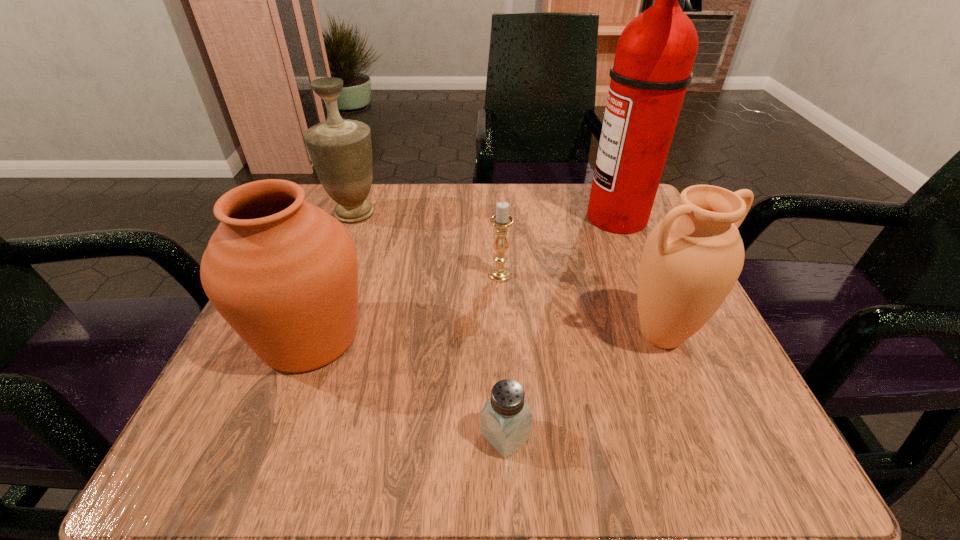
Where is `object present at the far right corner`? object present at the far right corner is located at coordinates (655, 54).

Identify the location of vacant area at the far edge. (575, 233).

Identify the location of vacant position at the left edge of the desktop. (249, 370).

Where is `free space at the right edge of the desktop`? free space at the right edge of the desktop is located at coordinates (605, 285).

Find the location of `vacant area at the far left corner`. vacant area at the far left corner is located at coordinates (377, 215).

Locate an element on the screen. This screenshot has width=960, height=540. vacant region at the near left corner of the desktop is located at coordinates (219, 415).

Locate an element on the screen. The image size is (960, 540). vacant space at the far right corner is located at coordinates (648, 228).

Where is `vacant area at the near right corner`? This screenshot has height=540, width=960. vacant area at the near right corner is located at coordinates coord(695,465).

Find the location of a particular element. This screenshot has width=960, height=540. unoccupied area between the shortest object and the fifth tallest object is located at coordinates (502, 355).

Identify the location of vacant space in between the tallest object and the shortest object. This screenshot has width=960, height=540. (562, 327).